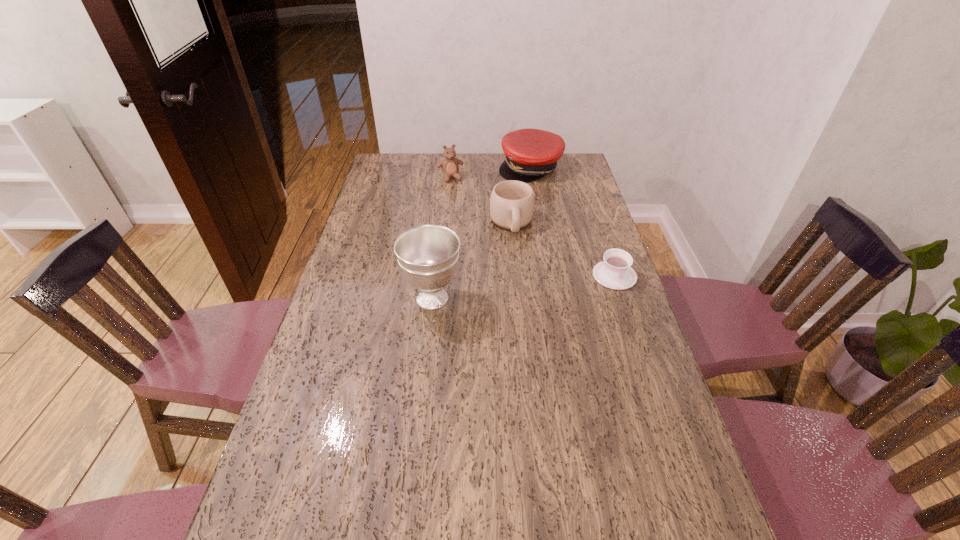
Locate an element on the screen. The height and width of the screenshot is (540, 960). vacant region located on the front-facing side of the cap is located at coordinates (538, 221).

Where is `free spot located on the side of the third nearest object with the handle`? free spot located on the side of the third nearest object with the handle is located at coordinates (520, 266).

You are a GUI agent. You are given a task and a screenshot of the screen. Output one action in this format:
    pyautogui.click(x=<x>, y=<y>)
    Task: Click on the free point located 0.180m on the side of the third nearest object with the handle
    This screenshot has width=960, height=540.
    Given the screenshot: What is the action you would take?
    pyautogui.click(x=522, y=274)

I want to click on vacant region located on the side of the third nearest object with the handle, so click(x=525, y=287).

This screenshot has width=960, height=540. I want to click on free space located 0.230m on the front-facing side of the teddy bear, so click(x=468, y=214).

Image resolution: width=960 pixels, height=540 pixels. I want to click on free space located 0.270m on the front-facing side of the teddy bear, so click(x=470, y=219).

Image resolution: width=960 pixels, height=540 pixels. What are the coordinates of `vacant area located 0.320m on the front-facing side of the teddy bear` in the screenshot? It's located at (473, 227).

Where is `cap located at the far edge`? This screenshot has height=540, width=960. cap located at the far edge is located at coordinates (530, 154).

Image resolution: width=960 pixels, height=540 pixels. I want to click on teddy bear located at the far edge, so click(450, 165).

The height and width of the screenshot is (540, 960). In order to click on teacup that is at the right edge in this screenshot , I will do `click(614, 272)`.